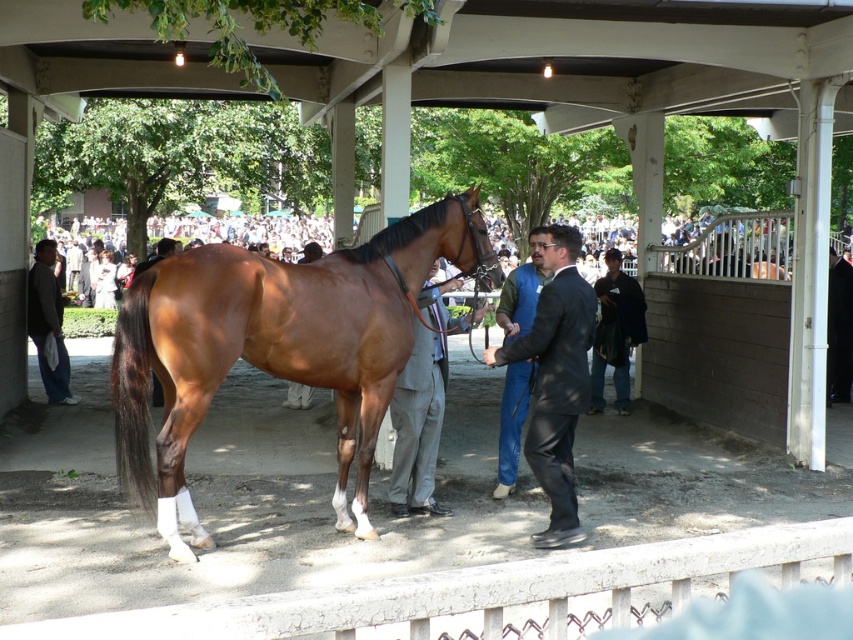
Question: Which object is positioned farthest from the blue jeans at center?

Choices:
 (A) dark gray suit at left
 (B) brown glossy horse at center
 (C) black suit at center

Answer: (A)

Question: Among these objects, which one is nearest to the camera?

Choices:
 (A) brown glossy horse at center
 (B) blue jeans at center
 (C) dark gray suit at left

Answer: (A)

Question: Is brown glossy horse at center positioned at the back of blue jeans at center?

Choices:
 (A) yes
 (B) no

Answer: (B)

Question: Does brown glossy horse at center have a larger size compared to black suit at center?

Choices:
 (A) yes
 (B) no

Answer: (A)

Question: Can you confirm if brown glossy horse at center is wider than blue jeans at center?

Choices:
 (A) no
 (B) yes

Answer: (B)

Question: Which object appears farthest from the camera in this image?

Choices:
 (A) dark gray suit at left
 (B) brown glossy horse at center
 (C) black suit at center

Answer: (A)